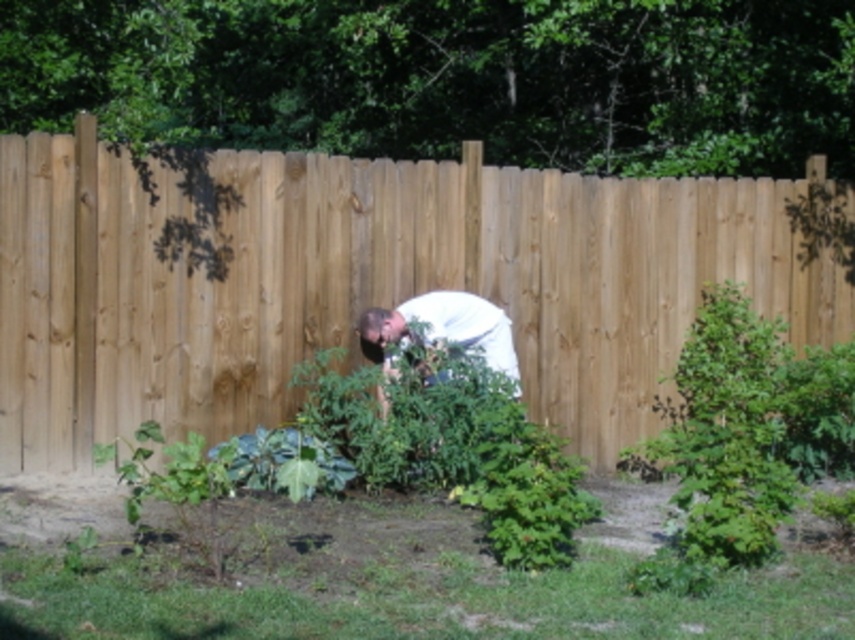
Who is positioned more to the left, natural wood fence at center or white matte shirt at center?

From the viewer's perspective, natural wood fence at center appears more on the left side.

Does point (276, 404) lie behind point (382, 413)?

Yes, point (276, 404) is behind point (382, 413).

Image resolution: width=855 pixels, height=640 pixels. Find the location of `natural wood fence at center`. natural wood fence at center is located at coordinates (364, 285).